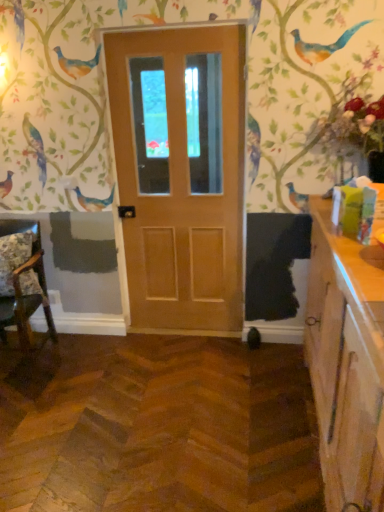
Identify the location of wooden cabinet at right. (346, 362).

What do you see at coordinates (22, 280) in the screenshot?
I see `wooden floral-patterned chair at left` at bounding box center [22, 280].

Find the location of a particular element. This screenshot has width=384, height=512. fluffy floral pillow at left is located at coordinates (13, 258).

Between wooden floral-patterned chair at left and matte wood door at center, which one has larger size?

wooden floral-patterned chair at left is bigger.

What's the angular difference between wooden floral-patterned chair at left and matte wood door at center's facing directions?

The angular difference between wooden floral-patterned chair at left and matte wood door at center is 1.77 degrees.

Are wooden floral-patterned chair at left and matte wood door at center beside each other?

No, wooden floral-patterned chair at left is not next to matte wood door at center.

Looking at this image, from the image's perspective, is wooden floral-patterned chair at left positioned above or below matte wood door at center?

wooden floral-patterned chair at left is situated lower than matte wood door at center in the image.

From a real-world perspective, which object stands above the other?

matte wood door at center, from a real-world perspective.

Considering the relative positions of wooden cabinet at right and matte wood door at center in the image provided, is wooden cabinet at right to the right of matte wood door at center from the viewer's perspective?

Correct, you'll find wooden cabinet at right to the right of matte wood door at center.

In the image, there is a matte wood door at center. Identify the location of cabinetry below it (from the image's perspective). This screenshot has height=512, width=384. (346, 362).

Looking at their sizes, would you say wooden floral-patterned chair at left is wider or thinner than wooden cabinet at right?

Clearly, wooden floral-patterned chair at left has more width compared to wooden cabinet at right.

Where is `chair that is under the wooden cabinet at right (from a real-world perspective)`? Image resolution: width=384 pixels, height=512 pixels. chair that is under the wooden cabinet at right (from a real-world perspective) is located at coordinates (x=22, y=280).

Would you consider wooden floral-patterned chair at left to be distant from wooden cabinet at right?

Yes, wooden floral-patterned chair at left and wooden cabinet at right are quite far apart.

Consider the image. From the image's perspective, which is below, wooden floral-patterned chair at left or wooden cabinet at right?

wooden cabinet at right is shown below in the image.

In the scene shown: From a real-world perspective, who is located higher, matte wood door at center or wooden floral-patterned chair at left?

matte wood door at center, from a real-world perspective.

From the picture: Is matte wood door at center next to wooden floral-patterned chair at left?

matte wood door at center and wooden floral-patterned chair at left are not in contact.

Does matte wood door at center appear on the left side of wooden floral-patterned chair at left?

In fact, matte wood door at center is to the right of wooden floral-patterned chair at left.

Could you tell me if matte wood door at center is facing wooden floral-patterned chair at left?

No, matte wood door at center is not oriented towards wooden floral-patterned chair at left.

Is wooden floral-patterned chair at left next to fluffy floral pillow at left?

Yes, wooden floral-patterned chair at left is right next to fluffy floral pillow at left and making contact.

In the scene shown: Does wooden floral-patterned chair at left appear on the right side of fluffy floral pillow at left?

No.

Is wooden floral-patterned chair at left facing away from fluffy floral pillow at left?

Correct, wooden floral-patterned chair at left is looking away from fluffy floral pillow at left.

From the image's perspective, is wooden floral-patterned chair at left over fluffy floral pillow at left?

No.

Is fluffy floral pillow at left positioned with its back to wooden floral-patterned chair at left?

Yes, fluffy floral pillow at left is positioned with its back facing wooden floral-patterned chair at left.

Is there a large distance between fluffy floral pillow at left and wooden floral-patterned chair at left?

No, fluffy floral pillow at left is in close proximity to wooden floral-patterned chair at left.

From the image's perspective, is fluffy floral pillow at left on wooden floral-patterned chair at left?

Yes, from the image's perspective, fluffy floral pillow at left is on top of wooden floral-patterned chair at left.

Considering the relative positions of fluffy floral pillow at left and wooden floral-patterned chair at left in the image provided, is fluffy floral pillow at left in front of wooden floral-patterned chair at left?

No, it is not.

How different are the orientations of matte wood door at center and fluffy floral pillow at left in degrees?

They differ by 1.77 degrees in their facing directions.

From a real-world perspective, between matte wood door at center and fluffy floral pillow at left, who is vertically higher?

In real-world perspective, matte wood door at center is above.

Looking at this image, which is more to the right, matte wood door at center or fluffy floral pillow at left?

Positioned to the right is matte wood door at center.

At what (x,y) coordinates should I click in order to perform the action: click on door positioned vertically above the fluffy floral pillow at left (from a real-world perspective). Please return your answer as a coordinate pair (x, y). Looking at the image, I should click on (181, 174).

At what (x,y) coordinates should I click in order to perform the action: click on chair below the matte wood door at center (from the image's perspective). Please return your answer as a coordinate pair (x, y). The image size is (384, 512). Looking at the image, I should click on (22, 280).

Locate an element on the screen. Image resolution: width=384 pixels, height=512 pixels. door located behind the wooden cabinet at right is located at coordinates (181, 174).

Looking at the image, which one is located closer to fluffy floral pillow at left, wooden cabinet at right or wooden floral-patterned chair at left?

wooden floral-patterned chair at left is positioned closer to the anchor fluffy floral pillow at left.

Considering their positions, is wooden floral-patterned chair at left positioned further to matte wood door at center than fluffy floral pillow at left?

Based on the image, fluffy floral pillow at left appears to be further to matte wood door at center.

Looking at the image, which one is located further to wooden cabinet at right, matte wood door at center or wooden floral-patterned chair at left?

wooden floral-patterned chair at left lies further to wooden cabinet at right than the other object.

When comparing their distances from fluffy floral pillow at left, does matte wood door at center or wooden floral-patterned chair at left seem further?

The object further to fluffy floral pillow at left is matte wood door at center.

Estimate the real-world distances between objects in this image. Which object is further from wooden cabinet at right, fluffy floral pillow at left or wooden floral-patterned chair at left?

wooden floral-patterned chair at left.

When comparing their distances from fluffy floral pillow at left, does wooden floral-patterned chair at left or wooden cabinet at right seem further?

Among the two, wooden cabinet at right is located further to fluffy floral pillow at left.

Considering their positions, is matte wood door at center positioned further to wooden floral-patterned chair at left than fluffy floral pillow at left?

matte wood door at center is positioned further to the anchor wooden floral-patterned chair at left.

Considering their positions, is matte wood door at center positioned further to wooden floral-patterned chair at left than wooden cabinet at right?

The object further to wooden floral-patterned chair at left is wooden cabinet at right.

Locate an element on the screen. The height and width of the screenshot is (512, 384). pillow between wooden floral-patterned chair at left and matte wood door at center from left to right is located at coordinates [13, 258].

Locate an element on the screen. The width and height of the screenshot is (384, 512). door between wooden floral-patterned chair at left and wooden cabinet at right from left to right is located at coordinates (x=181, y=174).

Locate an element on the screen. This screenshot has height=512, width=384. door between fluffy floral pillow at left and wooden cabinet at right is located at coordinates (181, 174).

The height and width of the screenshot is (512, 384). What are the coordinates of `pillow between wooden floral-patterned chair at left and wooden cabinet at right in the horizontal direction` in the screenshot? It's located at (13, 258).